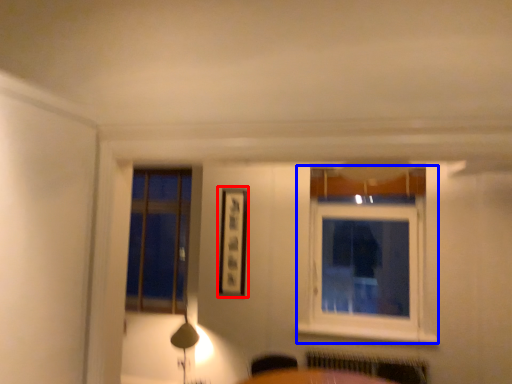
Question: Which object is further to the camera taking this photo, picture frame (highlighted by a red box) or window (highlighted by a blue box)?

Choices:
 (A) picture frame
 (B) window

Answer: (A)